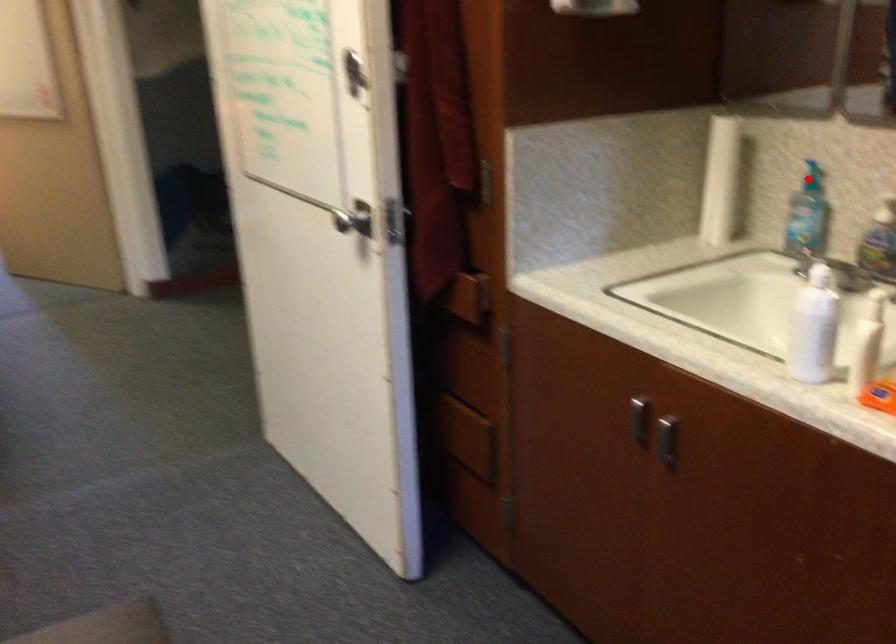
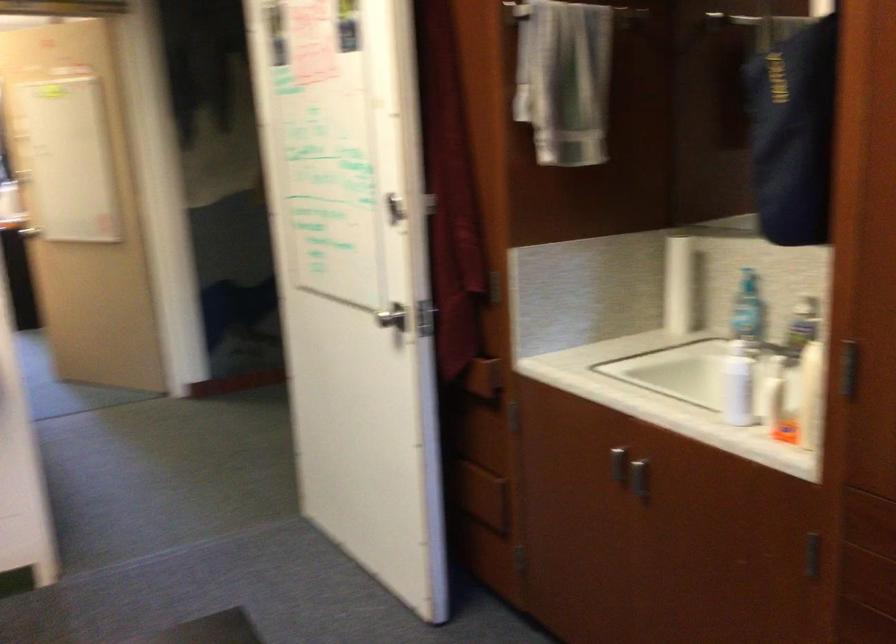
Where in the second image is the point corresponding to the highlighted location from the first image?

(747, 279)